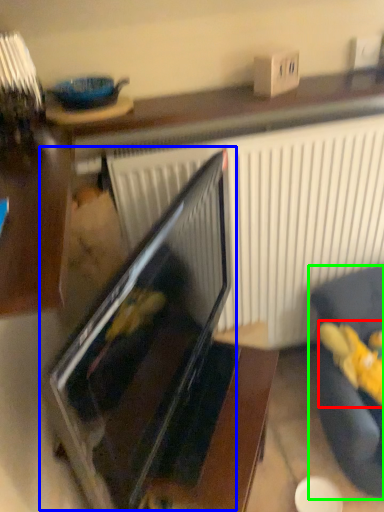
Question: Based on their relative distances, which object is farther from stuff (highlighted by a red box)? Choose from oven (highlighted by a blue box) and furniture (highlighted by a green box).

Choices:
 (A) oven
 (B) furniture

Answer: (A)